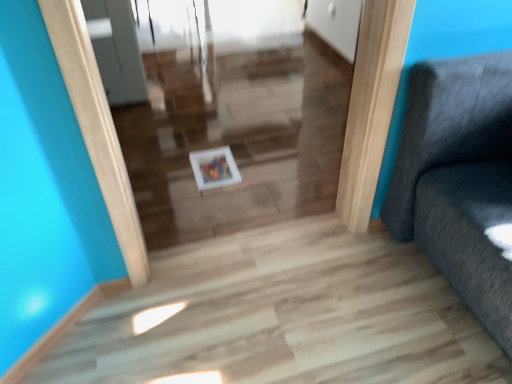
Question: Does white glossy picture frame at center have a lesser height compared to white glossy tray at center?

Choices:
 (A) yes
 (B) no

Answer: (A)

Question: Is white glossy picture frame at center positioned beyond the bounds of white glossy tray at center?

Choices:
 (A) yes
 (B) no

Answer: (A)

Question: Does white glossy picture frame at center lie in front of white glossy tray at center?

Choices:
 (A) yes
 (B) no

Answer: (B)

Question: Does white glossy picture frame at center have a lesser width compared to white glossy tray at center?

Choices:
 (A) yes
 (B) no

Answer: (B)

Question: From the image's perspective, is white glossy picture frame at center below white glossy tray at center?

Choices:
 (A) no
 (B) yes

Answer: (B)

Question: Considering the relative sizes of white glossy picture frame at center and white glossy tray at center in the image provided, is white glossy picture frame at center bigger than white glossy tray at center?

Choices:
 (A) yes
 (B) no

Answer: (B)

Question: Does white glossy tray at center contain white glossy picture frame at center?

Choices:
 (A) yes
 (B) no

Answer: (B)

Question: Is white glossy tray at center to the right of white glossy picture frame at center from the viewer's perspective?

Choices:
 (A) yes
 (B) no

Answer: (A)

Question: Is white glossy tray at center smaller than white glossy picture frame at center?

Choices:
 (A) no
 (B) yes

Answer: (A)

Question: Does white glossy tray at center have a larger size compared to white glossy picture frame at center?

Choices:
 (A) yes
 (B) no

Answer: (A)

Question: Can you confirm if white glossy tray at center is positioned to the left of white glossy picture frame at center?

Choices:
 (A) yes
 (B) no

Answer: (B)

Question: Is white glossy tray at center outside white glossy picture frame at center?

Choices:
 (A) no
 (B) yes

Answer: (B)

Question: From a real-world perspective, is white glossy picture frame at center positioned above or below white glossy tray at center?

Choices:
 (A) below
 (B) above

Answer: (A)